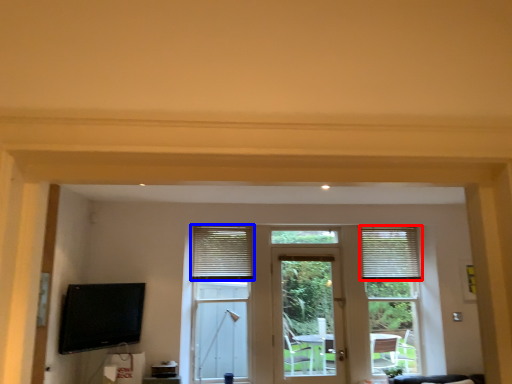
Question: Which object is closer to the camera taking this photo, window blind (highlighted by a red box) or window blind (highlighted by a blue box)?

Choices:
 (A) window blind
 (B) window blind

Answer: (B)